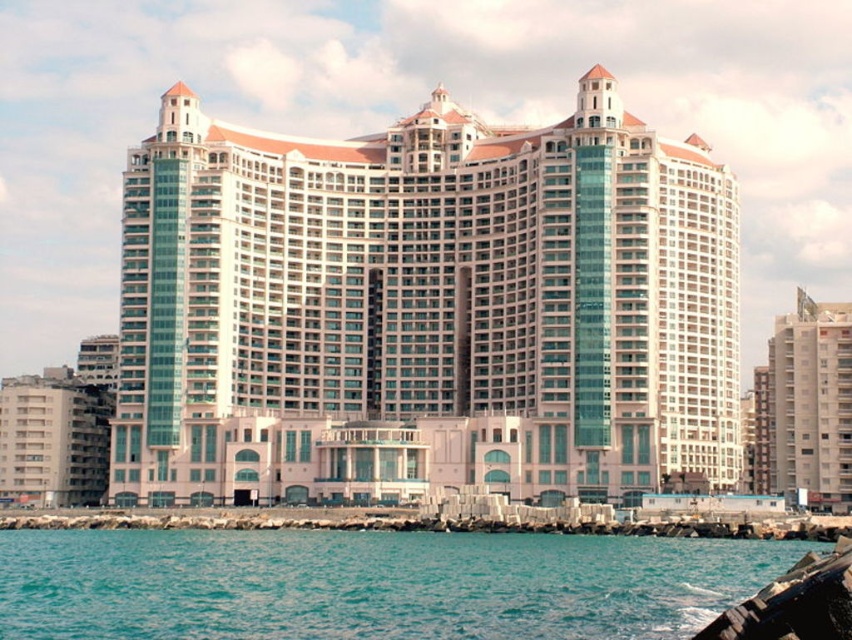
You are standing at the origin point of the coordinate system. You want to reach the white glass building at center. What direction should you move in to get there?

Since the white glass building at center is located at coordinate point (x=426, y=310), you should move directly towards the center point as it is very close to the origin.

Looking at this image, you are a tourist standing on the rocky shoreline looking at the waterfront. You see the white glass building at center and the beige concrete building at lower left. Which building is located to the right side of the other?

The white glass building at center is positioned on the right side of beige concrete building at lower left.

You are standing at the point marked by the coordinates point [804,406] in the image. What is the closest object to you in the scene?

The point [804,406] indicates the beige concrete building at right, so the closest object to you is the beige concrete building at right.